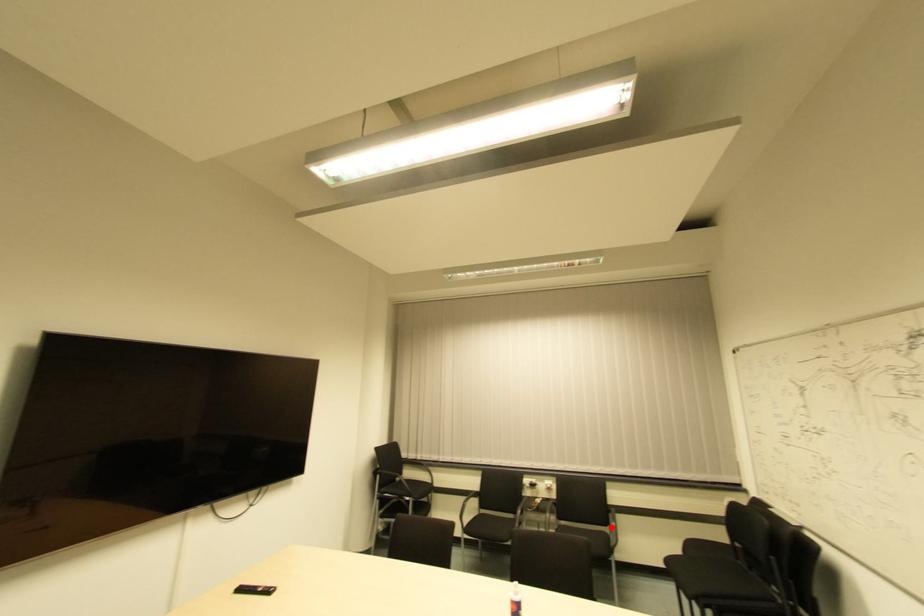
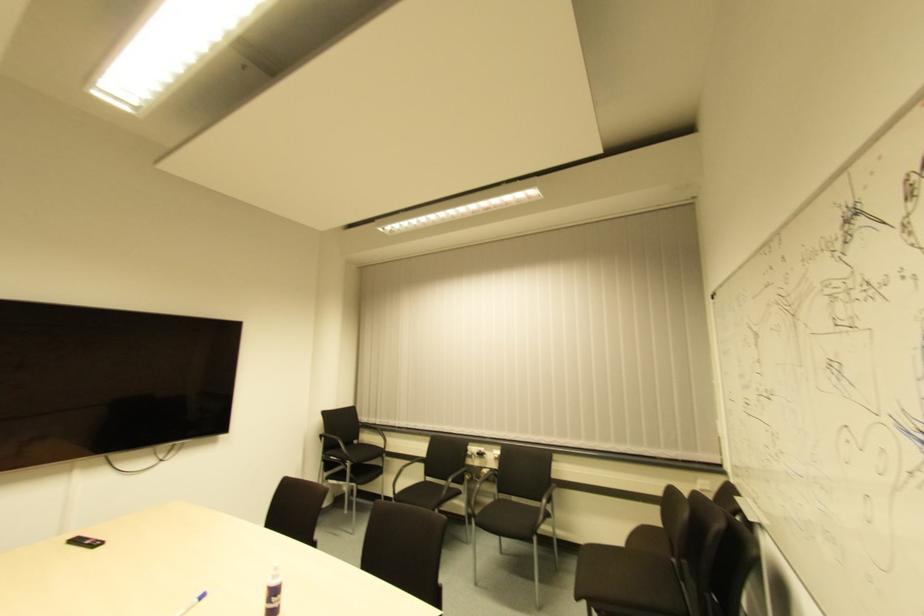
Question: A red point is marked in image1. In image2, is the corresponding 3D point closer to the camera or farther? Reply with the corresponding letter.

Choices:
 (A) The corresponding 3D point is closer.
 (B) The corresponding 3D point is farther.

Answer: (A)